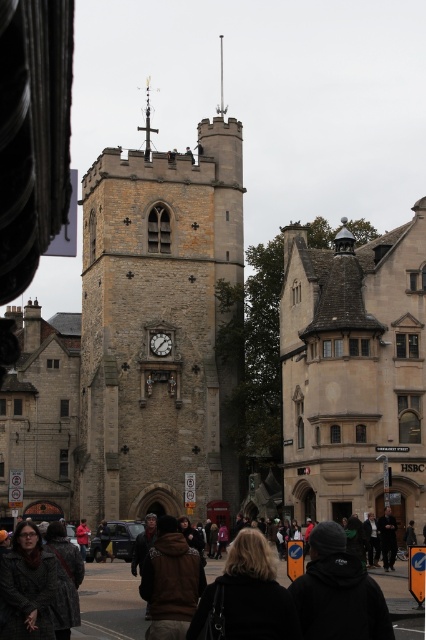
Does dark brown leather jacket at lower center lie in front of white marble clock at center?

Yes, dark brown leather jacket at lower center is closer to the viewer.

Is point (97, 609) behind point (166, 344)?

That is False.

You are a GUI agent. You are given a task and a screenshot of the screen. Output one action in this format:
    pyautogui.click(x=<x>, y=<y>)
    Task: Click on the dark brown leather jacket at lower center
    Image resolution: width=426 pixels, height=640 pixels.
    Given the screenshot: What is the action you would take?
    pyautogui.click(x=109, y=604)

Who is taller, brown stone clock tower at center or white marble clock at center?

brown stone clock tower at center is taller.

Who is more forward, (233, 253) or (154, 340)?

Point (154, 340) is in front.

I want to click on brown stone clock tower at center, so click(158, 324).

Who is positioned more to the left, brown stone clock tower at center or dark brown leather jacket at lower center?

Positioned to the left is brown stone clock tower at center.

This screenshot has width=426, height=640. Identify the location of brown stone clock tower at center. (158, 324).

Who is more forward, (158, 234) or (112, 611)?

Point (112, 611) is in front.

Identify the location of brown stone clock tower at center. Image resolution: width=426 pixels, height=640 pixels. (158, 324).